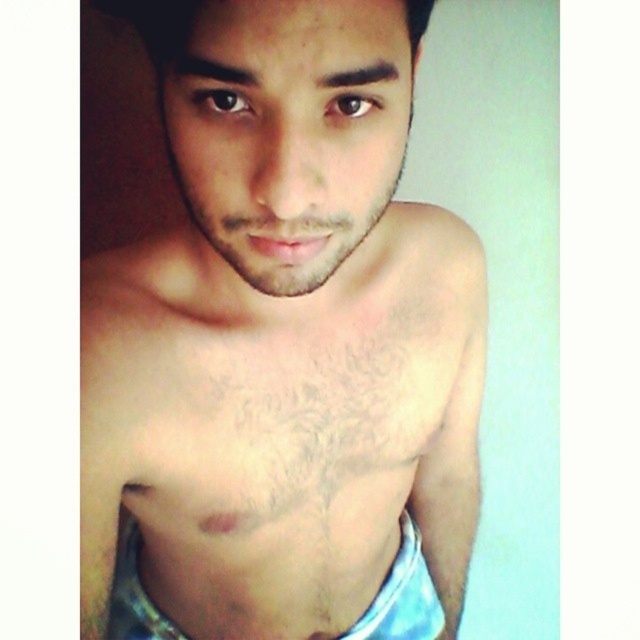
Question: Is pale skin at center above blue fabric shorts at center?

Choices:
 (A) yes
 (B) no

Answer: (A)

Question: Which object is farther from the camera taking this photo?

Choices:
 (A) pale skin at center
 (B) blue fabric shorts at center

Answer: (B)

Question: Where is pale skin at center located in relation to blue fabric shorts at center in the image?

Choices:
 (A) left
 (B) right

Answer: (A)

Question: Can you confirm if pale skin at center is positioned below blue fabric shorts at center?

Choices:
 (A) yes
 (B) no

Answer: (B)

Question: Among these objects, which one is nearest to the camera?

Choices:
 (A) blue fabric shorts at center
 (B) pale skin at center

Answer: (B)